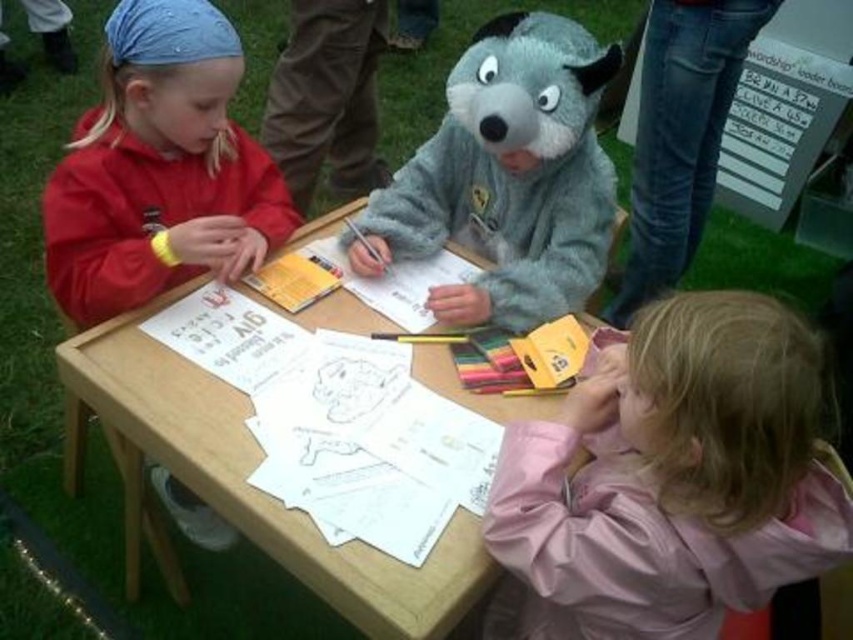
Consider the image. You are a photographer taking a picture of the matte red hoodie at left and the wooden at center. Which object should you adjust to ensure both are in focus? Explain your reasoning.

The matte red hoodie at left has a lesser height compared to wooden at center. To ensure both are in focus, adjust the matte red hoodie at left to raise its position so it aligns with the height of the wooden at center.

You are a toy delivery person who needs to place a small box between the matte red hoodie at left and the fuzzy gray costume at center. The box is 16 inches long. Will it fit without overlapping either item?

The distance between the matte red hoodie at left and the fuzzy gray costume at center is 16.66 inches. Since the box is 16 inches long, it will fit within the space without overlapping either item.